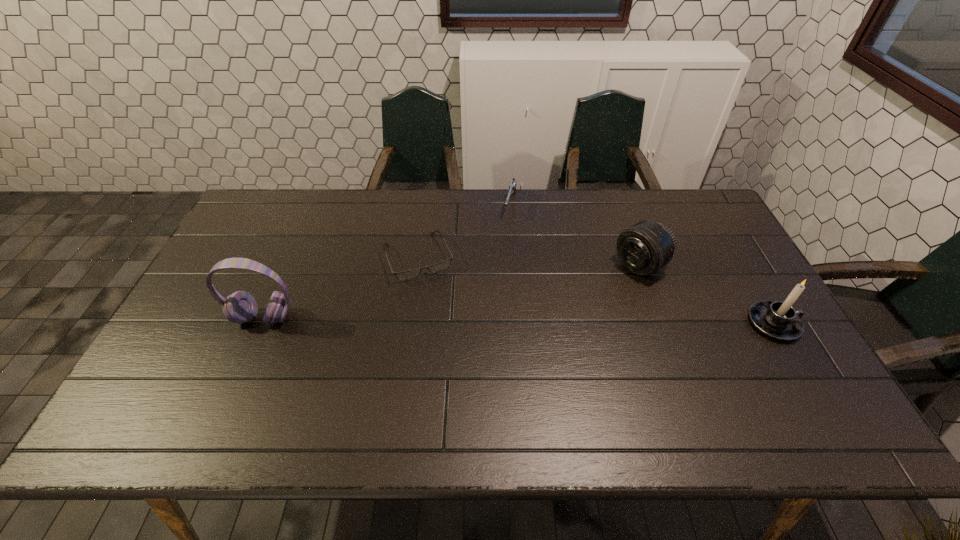
This screenshot has height=540, width=960. I want to click on free location that satisfies the following two spatial constraints: 1. on the headband and ear cups of the tallest object; 2. with a handle on the side of the rightmost object, so click(x=261, y=323).

This screenshot has height=540, width=960. I want to click on free space that satisfies the following two spatial constraints: 1. on the front side of the pistol; 2. with a handle on the side of the candle holder, so click(519, 323).